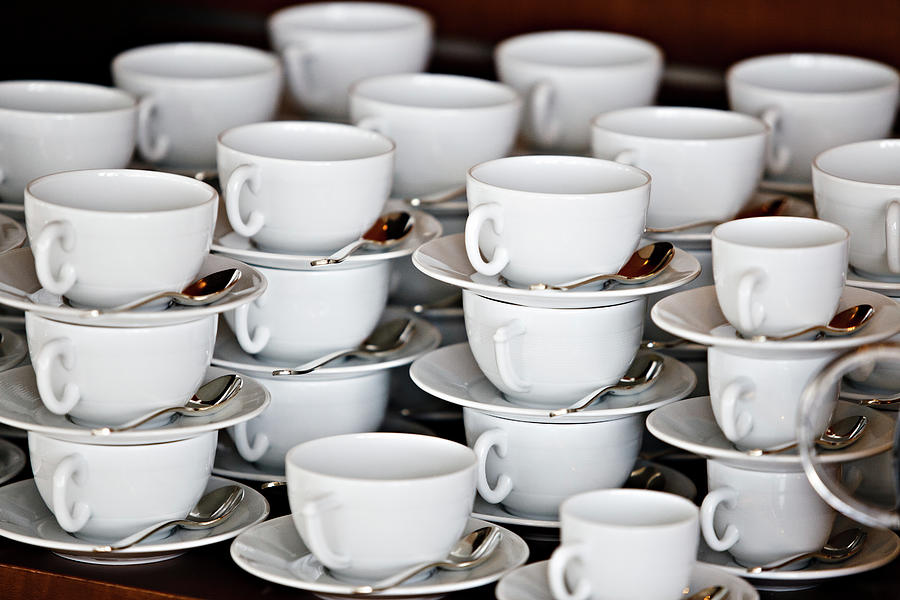
At what (x,y) coordinates should I click in order to perform the action: click on 3 cups on top of rear cup towers, top left corner. Please return your answer as a coordinate pair (x, y). Looking at the image, I should click on (82, 108), (199, 87), (355, 50).